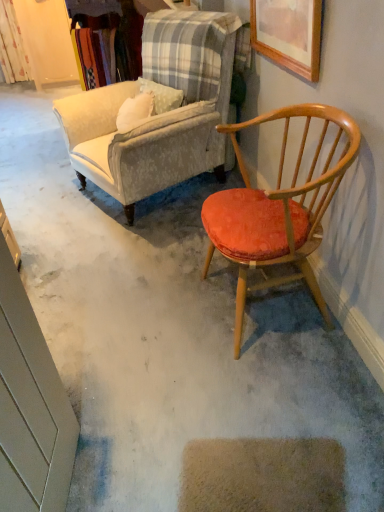
Question: Would you consider velvet beige armchair at upper left, the first chair when ordered from back to front, to be distant from wooden picture frame at upper right?

Choices:
 (A) yes
 (B) no

Answer: (B)

Question: Is velvet beige armchair at upper left, the first chair when ordered from back to front, at the right side of wooden picture frame at upper right?

Choices:
 (A) yes
 (B) no

Answer: (B)

Question: Can you confirm if velvet beige armchair at upper left, which is the 2th chair from front to back, is taller than wooden picture frame at upper right?

Choices:
 (A) no
 (B) yes

Answer: (B)

Question: Can you confirm if velvet beige armchair at upper left, which is the 2th chair from front to back, is wider than wooden picture frame at upper right?

Choices:
 (A) no
 (B) yes

Answer: (B)

Question: Is velvet beige armchair at upper left, which is the 2th chair from front to back, in front of wooden picture frame at upper right?

Choices:
 (A) no
 (B) yes

Answer: (A)

Question: From the image's perspective, would you say velvet beige armchair at upper left, the first chair when ordered from back to front, is shown under wooden picture frame at upper right?

Choices:
 (A) yes
 (B) no

Answer: (A)

Question: Is the position of wooden picture frame at upper right more distant than that of velvet beige armchair at upper left, the first chair when ordered from back to front?

Choices:
 (A) yes
 (B) no

Answer: (B)

Question: Considering the relative sizes of wooden picture frame at upper right and velvet beige armchair at upper left, which is the 2th chair from front to back, in the image provided, is wooden picture frame at upper right bigger than velvet beige armchair at upper left, which is the 2th chair from front to back,?

Choices:
 (A) yes
 (B) no

Answer: (B)

Question: Is there a large distance between wooden picture frame at upper right and velvet beige armchair at upper left, the first chair when ordered from back to front?

Choices:
 (A) no
 (B) yes

Answer: (A)

Question: Is wooden picture frame at upper right surrounding velvet beige armchair at upper left, the first chair when ordered from back to front?

Choices:
 (A) yes
 (B) no

Answer: (B)

Question: Is wooden picture frame at upper right outside velvet beige armchair at upper left, which is the 2th chair from front to back?

Choices:
 (A) no
 (B) yes

Answer: (B)

Question: Is wooden picture frame at upper right placed right next to velvet beige armchair at upper left, the first chair when ordered from back to front?

Choices:
 (A) yes
 (B) no

Answer: (B)

Question: Considering the relative sizes of floral fabric curtain at upper left and velvet beige armchair at upper left, which is the 2th chair from front to back, in the image provided, is floral fabric curtain at upper left bigger than velvet beige armchair at upper left, which is the 2th chair from front to back,?

Choices:
 (A) no
 (B) yes

Answer: (A)